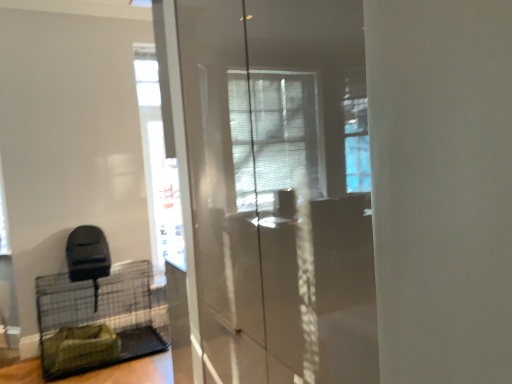
You are a GUI agent. You are given a task and a screenshot of the screen. Output one action in this format:
    pyautogui.click(x=<x>, y=<y>)
    Task: Click on the transparent glass screen door at center
    This screenshot has width=512, height=384.
    Given the screenshot: What is the action you would take?
    pyautogui.click(x=279, y=189)

This screenshot has height=384, width=512. What do you see at coordinates (279, 189) in the screenshot? I see `transparent glass screen door at center` at bounding box center [279, 189].

Describe the element at coordinates (100, 319) in the screenshot. The width and height of the screenshot is (512, 384). I see `green fabric birdcage at lower left` at that location.

Where is `green fabric birdcage at lower left`? This screenshot has width=512, height=384. green fabric birdcage at lower left is located at coordinates (100, 319).

What are the coordinates of `transparent glass screen door at center` in the screenshot? It's located at (279, 189).

Looking at this image, considering the relative positions of transparent glass screen door at center and green fabric birdcage at lower left in the image provided, is transparent glass screen door at center to the right of green fabric birdcage at lower left from the viewer's perspective?

Indeed, transparent glass screen door at center is positioned on the right side of green fabric birdcage at lower left.

Is the position of transparent glass screen door at center less distant than that of green fabric birdcage at lower left?

Yes, the depth of transparent glass screen door at center is less than that of green fabric birdcage at lower left.

Which point is more forward, (355,195) or (130,325)?

Positioned in front is point (355,195).

From the image's perspective, between transparent glass screen door at center and green fabric birdcage at lower left, who is located below?

green fabric birdcage at lower left appears lower in the image.

From a real-world perspective, which object stands above the other?

From a 3D spatial view, transparent glass screen door at center is above.

Considering the sizes of objects transparent glass screen door at center and green fabric birdcage at lower left in the image provided, who is wider, transparent glass screen door at center or green fabric birdcage at lower left?

Wider between the two is green fabric birdcage at lower left.

Can you confirm if transparent glass screen door at center is taller than green fabric birdcage at lower left?

Yes.

Which of these two, transparent glass screen door at center or green fabric birdcage at lower left, is bigger?

Bigger between the two is green fabric birdcage at lower left.

In the scene shown: Is green fabric birdcage at lower left located within transparent glass screen door at center?

No, green fabric birdcage at lower left is not inside transparent glass screen door at center.

Can you see transparent glass screen door at center touching green fabric birdcage at lower left?

No, transparent glass screen door at center is not with green fabric birdcage at lower left.

Is transparent glass screen door at center oriented away from green fabric birdcage at lower left?

transparent glass screen door at center does not have its back to green fabric birdcage at lower left.

The image size is (512, 384). Identify the location of screen door in front of the green fabric birdcage at lower left. (279, 189).

Is green fabric birdcage at lower left to the left of transparent glass screen door at center from the viewer's perspective?

Correct, you'll find green fabric birdcage at lower left to the left of transparent glass screen door at center.

Is green fabric birdcage at lower left in front of or behind transparent glass screen door at center in the image?

green fabric birdcage at lower left is behind transparent glass screen door at center.

Is point (65, 371) farther from camera compared to point (273, 357)?

Yes.

From the image's perspective, between green fabric birdcage at lower left and transparent glass screen door at center, which one is located above?

From the image's view, transparent glass screen door at center is above.

From a real-world perspective, who is located lower, green fabric birdcage at lower left or transparent glass screen door at center?

In real-world perspective, green fabric birdcage at lower left is lower.

Does green fabric birdcage at lower left have a lesser width compared to transparent glass screen door at center?

In fact, green fabric birdcage at lower left might be wider than transparent glass screen door at center.

Can you confirm if green fabric birdcage at lower left is shorter than transparent glass screen door at center?

Correct, green fabric birdcage at lower left is not as tall as transparent glass screen door at center.

In terms of size, does green fabric birdcage at lower left appear bigger or smaller than transparent glass screen door at center?

In the image, green fabric birdcage at lower left appears to be larger than transparent glass screen door at center.

Is transparent glass screen door at center completely or partially inside green fabric birdcage at lower left?

No, transparent glass screen door at center is located outside of green fabric birdcage at lower left.

Would you say green fabric birdcage at lower left is a long distance from transparent glass screen door at center?

green fabric birdcage at lower left is positioned a significant distance from transparent glass screen door at center.

Is green fabric birdcage at lower left looking in the opposite direction of transparent glass screen door at center?

That's not correct — green fabric birdcage at lower left is not looking away from transparent glass screen door at center.

How many degrees apart are the facing directions of green fabric birdcage at lower left and transparent glass screen door at center?

The angle between the facing direction of green fabric birdcage at lower left and the facing direction of transparent glass screen door at center is 90.5 degrees.

Where is `screen door located on the right of green fabric birdcage at lower left`? This screenshot has height=384, width=512. screen door located on the right of green fabric birdcage at lower left is located at coordinates (279, 189).

The image size is (512, 384). I want to click on screen door in front of the green fabric birdcage at lower left, so click(x=279, y=189).

This screenshot has width=512, height=384. In order to click on bird cage directly beneath the transparent glass screen door at center (from a real-world perspective) in this screenshot , I will do `click(100, 319)`.